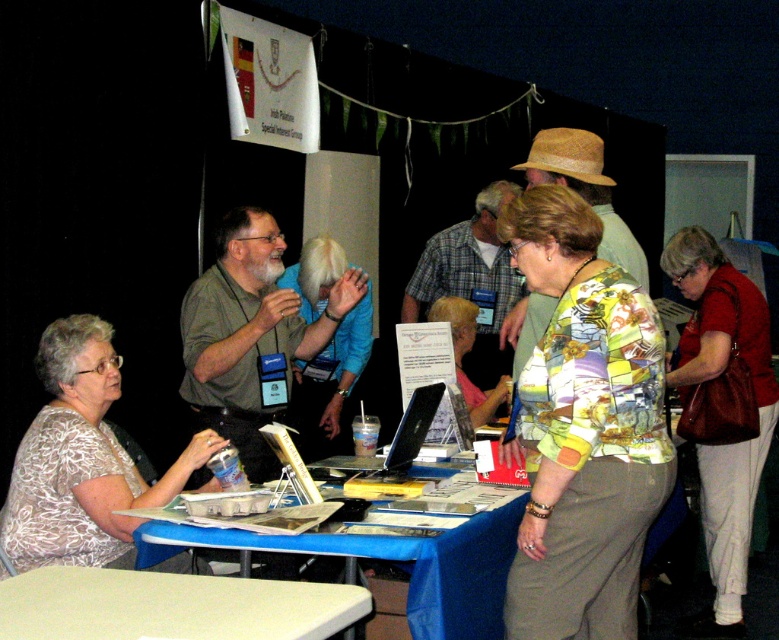
Is blue fabric table at lower center shorter than floral print blouse at center?

Correct, blue fabric table at lower center is not as tall as floral print blouse at center.

Which is in front, point (252, 550) or point (462, 300)?

Point (252, 550) is in front.

Is point (481, 584) positioned behind point (462, 339)?

No, (481, 584) is in front of (462, 339).

Where is `blue fabric table at lower center`? This screenshot has height=640, width=779. blue fabric table at lower center is located at coordinates (393, 561).

Does light green plastic table at lower left appear under blue fabric table at lower center?

No, light green plastic table at lower left is not below blue fabric table at lower center.

Is point (238, 627) positioned before point (351, 544)?

That is True.

At what (x,y) coordinates should I click in order to perform the action: click on light green plastic table at lower left. Please return your answer as a coordinate pair (x, y). Looking at the image, I should click on (171, 605).

Does red leather purse at lower right have a greater height compared to blue fabric table at lower center?

Yes, red leather purse at lower right is taller than blue fabric table at lower center.

Is red leather purse at lower right positioned in front of blue fabric table at lower center?

No, it is not.

Image resolution: width=779 pixels, height=640 pixels. What are the coordinates of `red leather purse at lower right` in the screenshot? It's located at (742, 422).

The width and height of the screenshot is (779, 640). What are the coordinates of `red leather purse at lower right` in the screenshot? It's located at (742, 422).